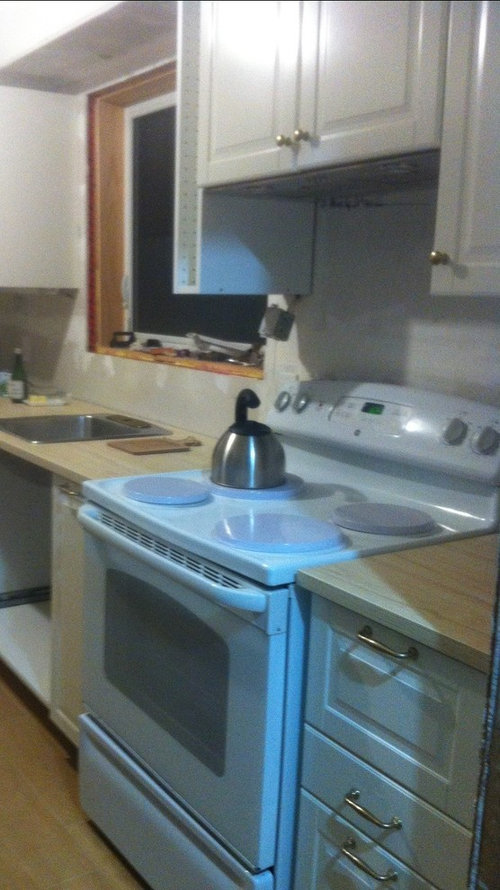
Identify the location of kitchen sink. The width and height of the screenshot is (500, 890). (107, 427).